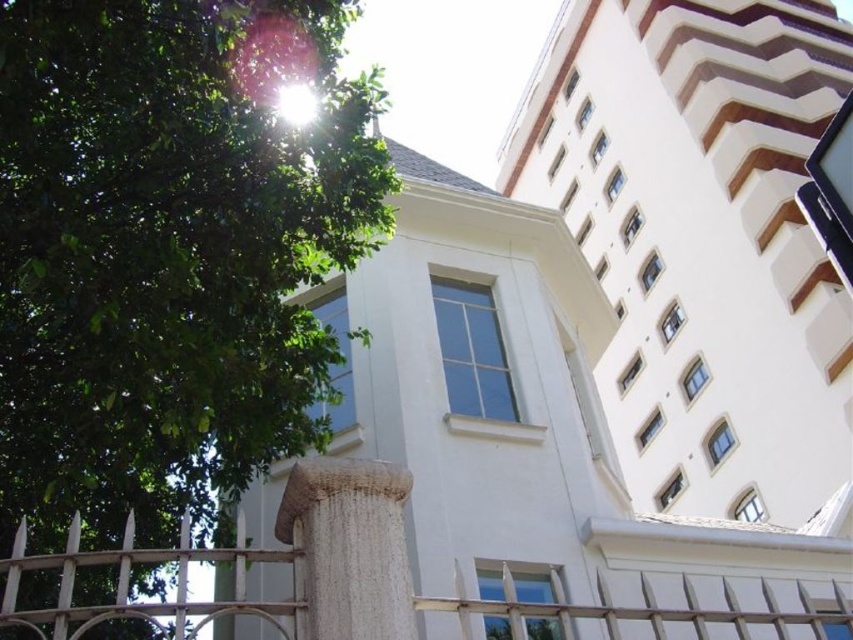
You are standing at the entrance of the building and want to walk towards the white metal fence at lower center. Which direction should you turn to face the white smooth building at upper right?

The white smooth building at upper right is to the right of the white metal fence at lower center. So, to face the white smooth building at upper right, you should turn to your right side.

You are standing at the entrance of the building and want to take a photo of the white smooth building at upper right and the white metal fence at lower center. Which object will appear larger in the photo?

The white smooth building at upper right will appear larger in the photo because it is much taller than the white metal fence at lower center.